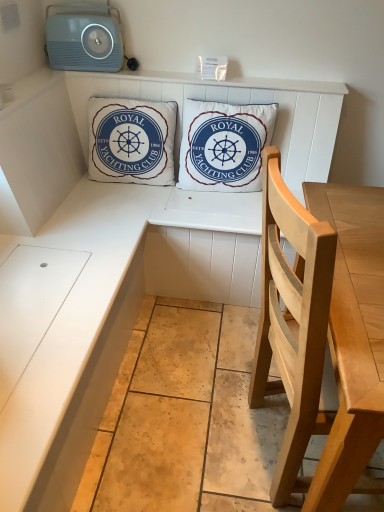
Question: From the image's perspective, is white cotton cushion at center, marked as the 1th pillow in a left-to-right arrangement, located above or below light blue plastic stereo at upper left?

Choices:
 (A) below
 (B) above

Answer: (A)

Question: Visually, is white cotton cushion at center, marked as the 1th pillow in a left-to-right arrangement, positioned to the left or to the right of light blue plastic stereo at upper left?

Choices:
 (A) right
 (B) left

Answer: (A)

Question: Which object is positioned closest to the light wood chair at right?

Choices:
 (A) light blue plastic stereo at upper left
 (B) white cotton cushion at center, marked as the 1th pillow in a left-to-right arrangement
 (C) white cotton cushion at center, the first pillow in the right-to-left sequence

Answer: (C)

Question: Which object is the closest to the light wood chair at right?

Choices:
 (A) light blue plastic stereo at upper left
 (B) white cotton cushion at center, the second pillow viewed from the left
 (C) white cotton cushion at center, marked as the 1th pillow in a left-to-right arrangement

Answer: (B)